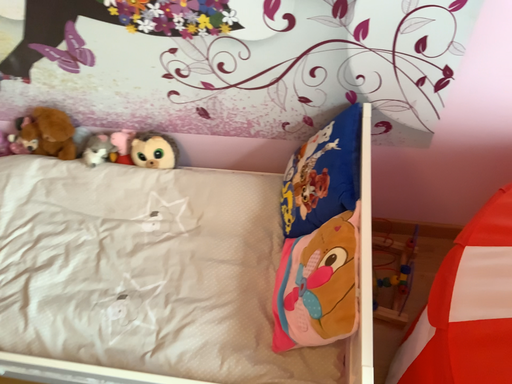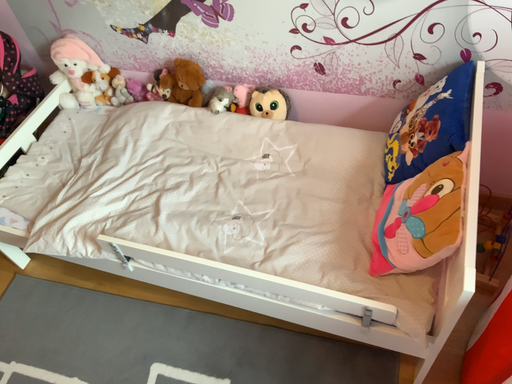
Question: How did the camera likely rotate when shooting the video?

Choices:
 (A) rotated left
 (B) rotated right

Answer: (A)